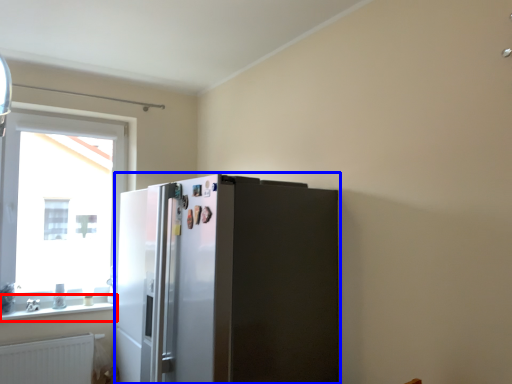
Question: Among these objects, which one is nearest to the camera, window sill (highlighted by a red box) or refrigerator (highlighted by a blue box)?

Choices:
 (A) window sill
 (B) refrigerator

Answer: (B)